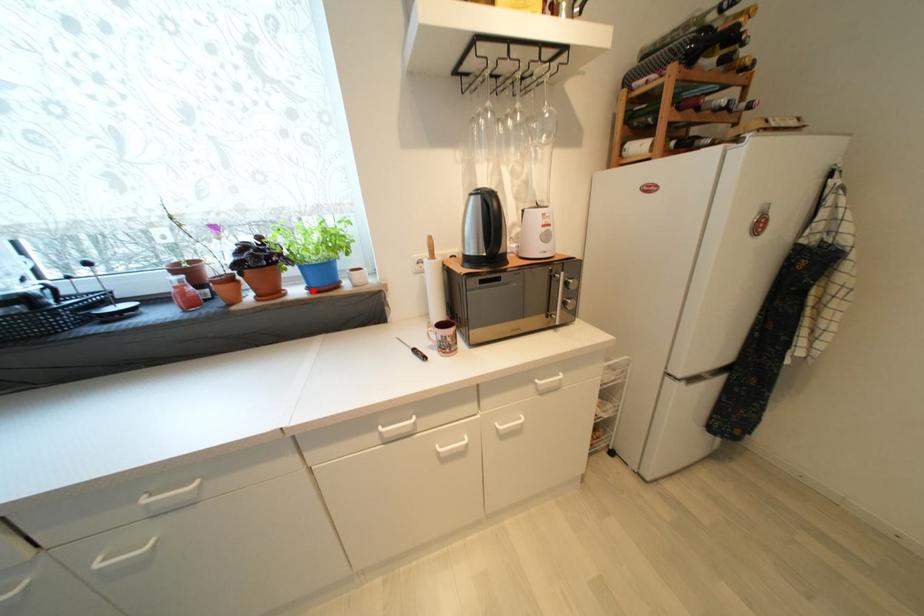
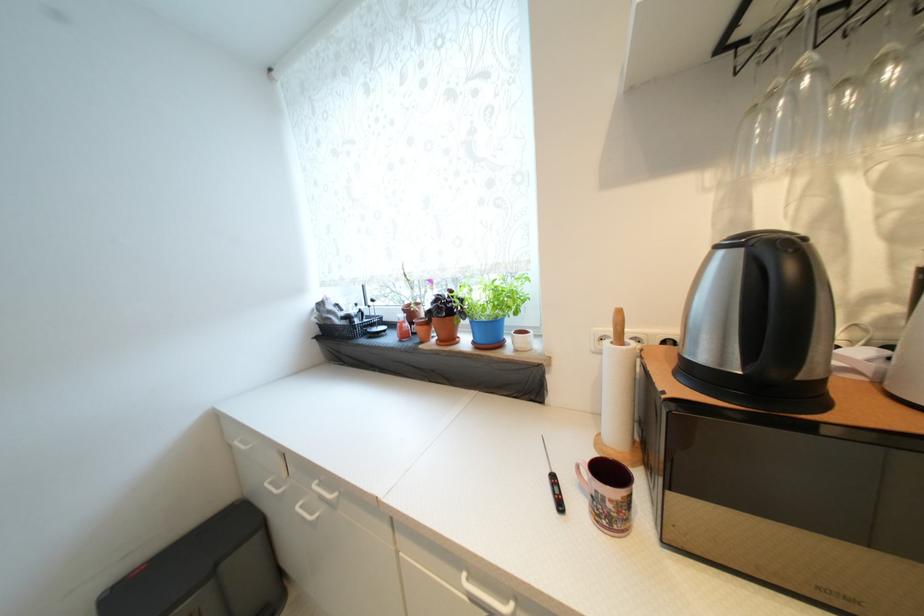
Locate, in the second image, the point that corresponds to the highlighted location in the first image.

(478, 344)